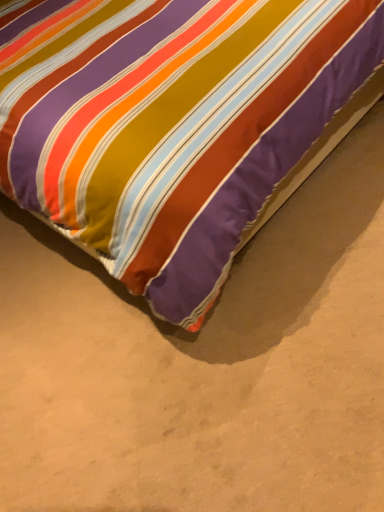
From the picture: Measure the distance between multicolored fabric bed at center and camera.

The depth of multicolored fabric bed at center is 39.01 inches.

The height and width of the screenshot is (512, 384). Describe the element at coordinates (184, 132) in the screenshot. I see `multicolored fabric bed at center` at that location.

This screenshot has height=512, width=384. What are the coordinates of `multicolored fabric bed at center` in the screenshot? It's located at (184, 132).

Find the location of a particular element. This screenshot has width=384, height=512. multicolored fabric bed at center is located at coordinates (184, 132).